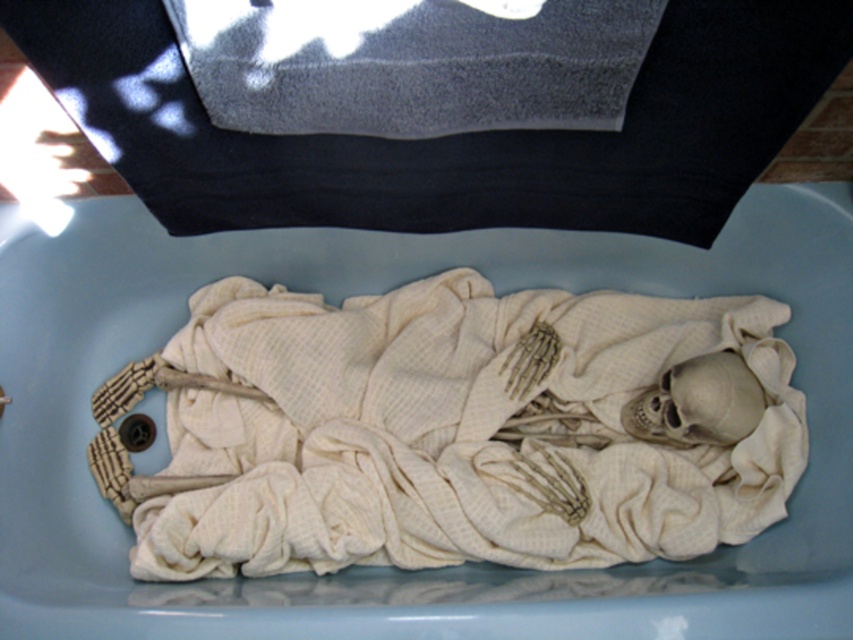
Question: Can you confirm if white fabric-covered skeleton at center is positioned to the left of gray cotton towel at upper center?

Choices:
 (A) yes
 (B) no

Answer: (A)

Question: Is white fabric-covered skeleton at center thinner than gray cotton towel at upper center?

Choices:
 (A) yes
 (B) no

Answer: (B)

Question: Does white fabric-covered skeleton at center have a smaller size compared to gray cotton towel at upper center?

Choices:
 (A) no
 (B) yes

Answer: (A)

Question: Among these points, which one is farthest from the camera?

Choices:
 (A) (811, 61)
 (B) (569, 596)

Answer: (B)

Question: Among these points, which one is nearest to the camera?

Choices:
 (A) (212, 131)
 (B) (790, 212)

Answer: (A)

Question: Which of the following is the farthest from the observer?

Choices:
 (A) gray cotton towel at upper center
 (B) white fabric-covered skeleton at center

Answer: (B)